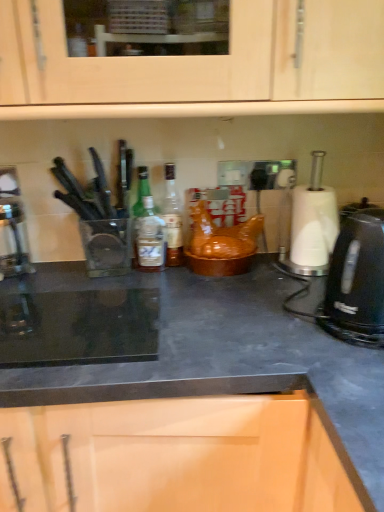
At what (x,y) coordinates should I click in order to perform the action: click on vacant space in front of green glass bottle at center. Please return your answer as a coordinate pair (x, y). Looking at the image, I should click on (148, 280).